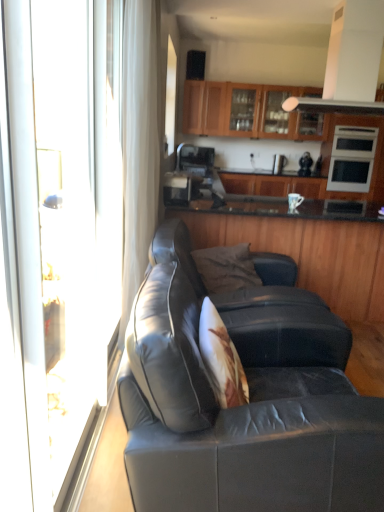
Question: From the image's perspective, does matte black leather couch at center appear lower than metallic silver coffee maker at center, the 2th appliance when ordered from right to left?

Choices:
 (A) yes
 (B) no

Answer: (A)

Question: Is matte black leather couch at center further to camera compared to metallic silver coffee maker at center, which is counted as the fourth appliance, starting from the front?

Choices:
 (A) no
 (B) yes

Answer: (A)

Question: Can you see matte black leather couch at center touching metallic silver coffee maker at center, which is counted as the fourth appliance, starting from the front?

Choices:
 (A) no
 (B) yes

Answer: (A)

Question: Does matte black leather couch at center appear on the left side of metallic silver coffee maker at center, the 1th appliance positioned from the back?

Choices:
 (A) yes
 (B) no

Answer: (A)

Question: Is metallic silver coffee maker at center, which is counted as the fourth appliance, starting from the front, inside matte black leather couch at center?

Choices:
 (A) yes
 (B) no

Answer: (B)

Question: Can you confirm if matte black leather couch at center is smaller than metallic silver coffee maker at center, the 1th appliance positioned from the back?

Choices:
 (A) no
 (B) yes

Answer: (A)

Question: Can you confirm if satin black coffee machine at center, positioned as the 4th appliance in back-to-front order, is wider than metallic silver coffee maker at center, the 1th appliance positioned from the back?

Choices:
 (A) no
 (B) yes

Answer: (B)

Question: Considering the relative positions of satin black coffee machine at center, which is counted as the first appliance, starting from the left, and metallic silver coffee maker at center, the 1th appliance positioned from the back, in the image provided, is satin black coffee machine at center, which is counted as the first appliance, starting from the left, to the right of metallic silver coffee maker at center, the 1th appliance positioned from the back, from the viewer's perspective?

Choices:
 (A) yes
 (B) no

Answer: (B)

Question: From the image's perspective, would you say satin black coffee machine at center, marked as the 1th appliance in a front-to-back arrangement, is positioned over metallic silver coffee maker at center, the 2th appliance when ordered from right to left?

Choices:
 (A) yes
 (B) no

Answer: (B)

Question: From a real-world perspective, is satin black coffee machine at center, which is counted as the 4th appliance, starting from the right, on top of metallic silver coffee maker at center, which is counted as the fourth appliance, starting from the front?

Choices:
 (A) no
 (B) yes

Answer: (A)

Question: Could you tell me if satin black coffee machine at center, marked as the 1th appliance in a front-to-back arrangement, is facing metallic silver coffee maker at center, placed as the third appliance when sorted from left to right?

Choices:
 (A) yes
 (B) no

Answer: (A)

Question: From the image's perspective, is satin black coffee machine at center, which is counted as the 4th appliance, starting from the right, under metallic silver coffee maker at center, the 2th appliance when ordered from right to left?

Choices:
 (A) no
 (B) yes

Answer: (B)

Question: From a real-world perspective, does transparent glass screen door at left sit lower than satin silver microwave at upper right, the 3th appliance positioned from the back?

Choices:
 (A) no
 (B) yes

Answer: (B)